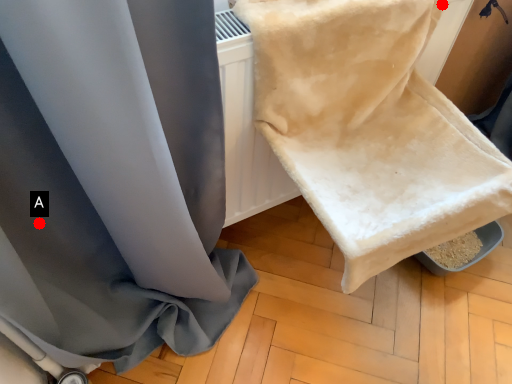
Question: Two points are circled on the image, labeled by A and B beside each circle. Which point is farther from the camera taking this photo?

Choices:
 (A) A is further
 (B) B is further

Answer: (B)